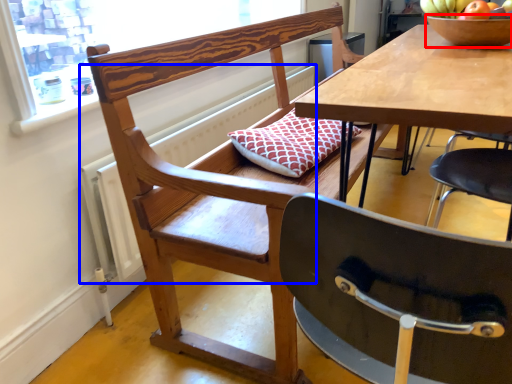
Question: Which object is further to the camera taking this photo, bowl (highlighted by a red box) or radiator (highlighted by a blue box)?

Choices:
 (A) bowl
 (B) radiator

Answer: (A)